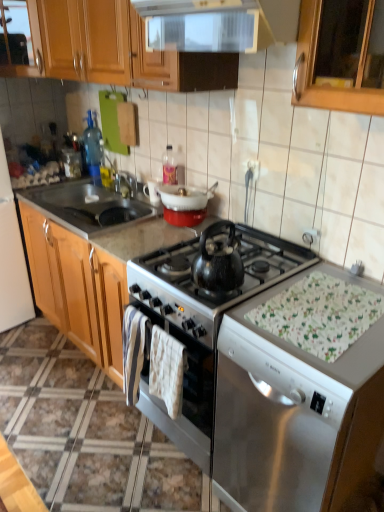
The image size is (384, 512). Identify the location of free spot above white fabric placemat at lower right (from a real-world perspective). (325, 302).